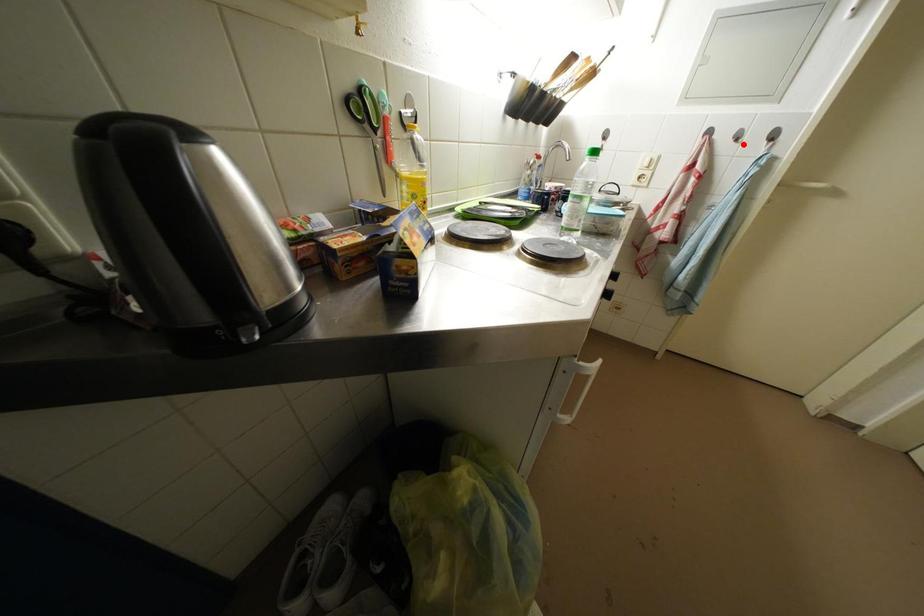
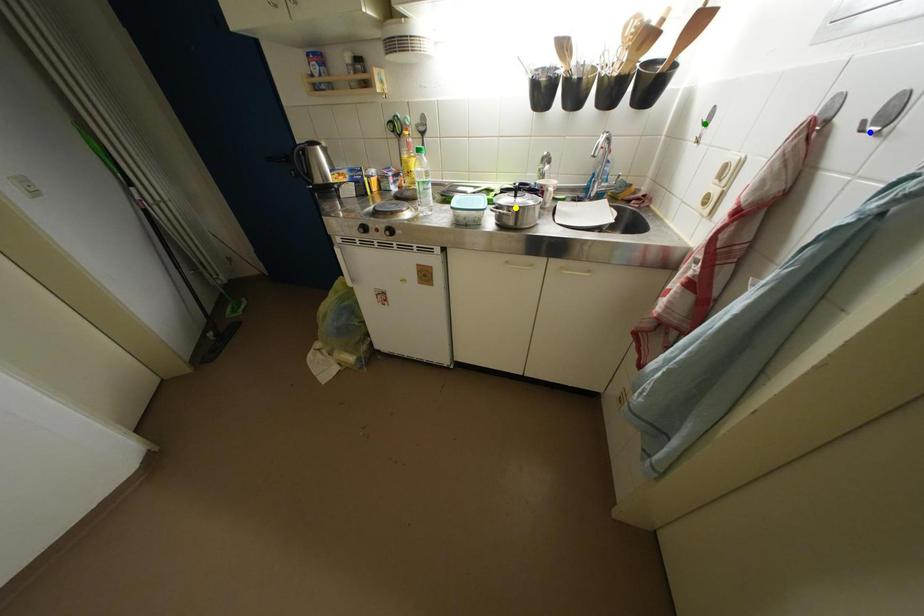
Question: I am providing you with two images of the same scene from different viewpoints. A red point is marked on the first image. You are given multiple points on the second image. Which mark in image 2 goes with the point in image 1?

Choices:
 (A) green point
 (B) yellow point
 (C) blue point

Answer: (C)